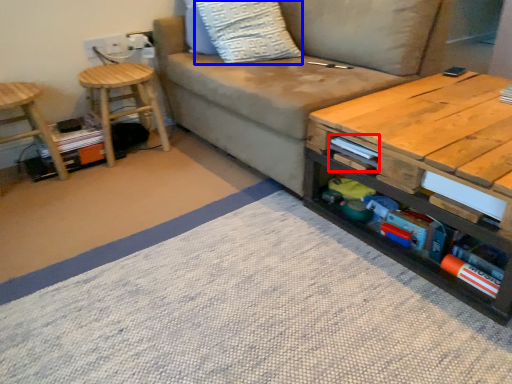
Question: Which object is closer to the camera taking this photo, book (highlighted by a red box) or throw pillow (highlighted by a blue box)?

Choices:
 (A) book
 (B) throw pillow

Answer: (A)